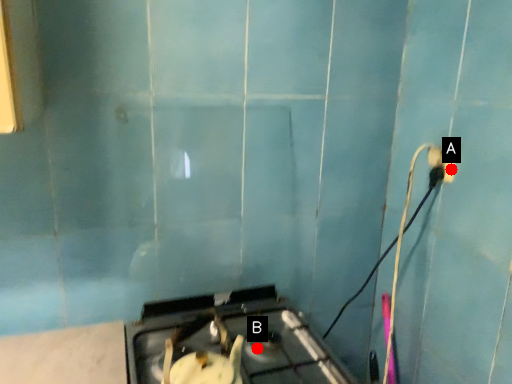
Question: Two points are circled on the image, labeled by A and B beside each circle. Which of the following is the closest to the observer?

Choices:
 (A) A is closer
 (B) B is closer

Answer: (B)